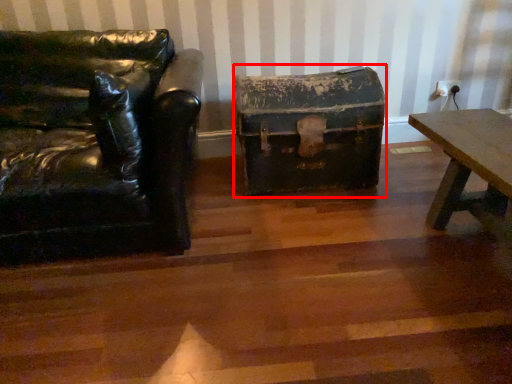
Question: Observing the image, what is the correct spatial positioning of box (annotated by the red box) in reference to chair?

Choices:
 (A) left
 (B) right

Answer: (B)